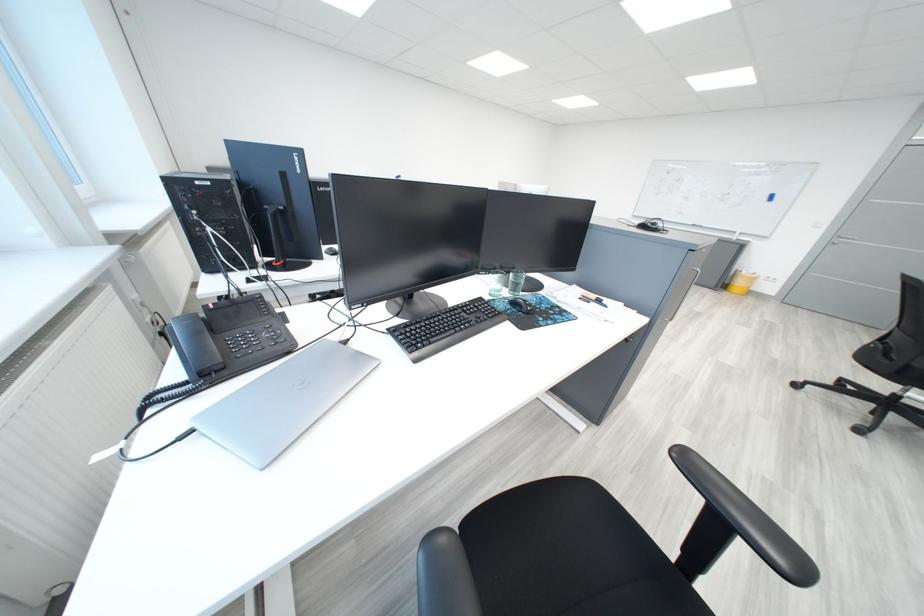
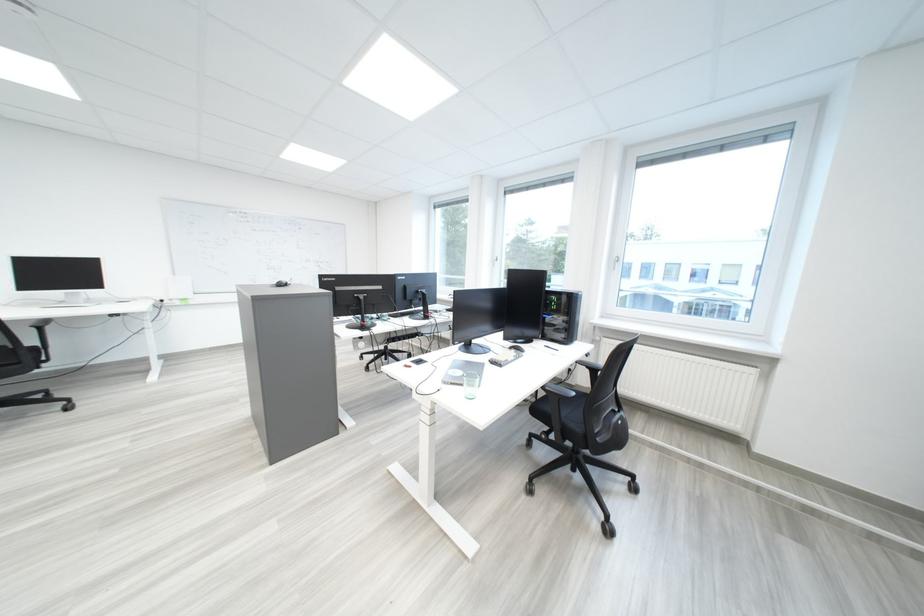
Question: I am providing you with two images of the same scene from different viewpoints. After the viewpoint changes to image2, which objects are now occluded?

Choices:
 (A) black computer mouse
 (B) padded chest support
 (C) black chair armrest
 (D) white window handle

Answer: (A)